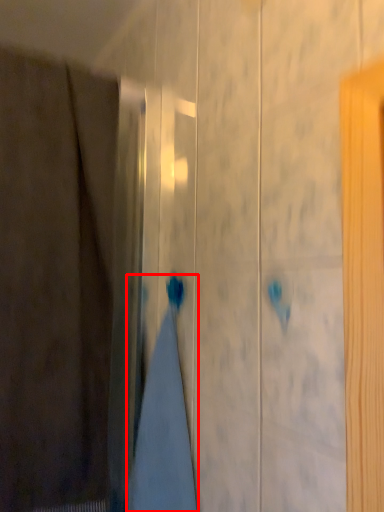
Question: From the image's perspective, where is bath towel (annotated by the red box) located relative to curtain?

Choices:
 (A) below
 (B) above

Answer: (A)